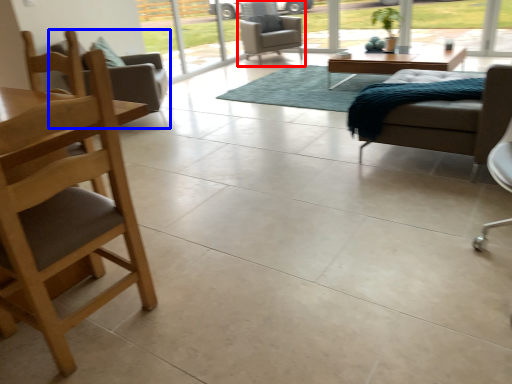
Question: Which object is further to the camera taking this photo, chair (highlighted by a red box) or chair (highlighted by a blue box)?

Choices:
 (A) chair
 (B) chair

Answer: (A)